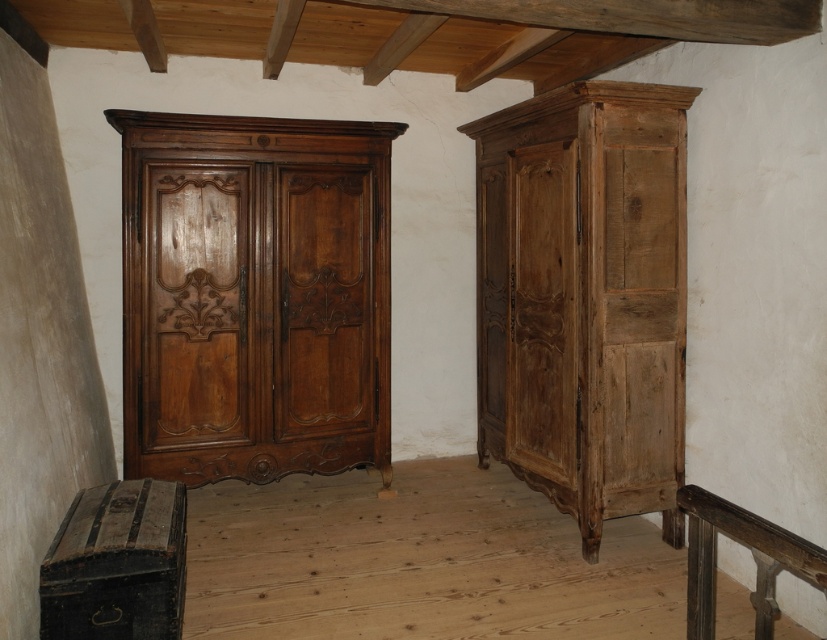
You are an interior designer planning to place a 1.2 meter wide rug in this room. The polished brown wood dresser at left and the natural wood dresser at right are both against the wall. Which dresser should the rug be placed in front of to ensure it doesn not extend beyond the dresser?

The polished brown wood dresser at left might be wider than natural wood dresser at right, so placing the rug in front of the polished brown wood dresser at left would be more likely to accommodate the rug without overhanging since it could have a larger surface area.

Consider the image. You are an interior designer planning to place a new sofa in this rustic room. The sofa is 2 meters long. You see the natural wood dresser at right and the rustic wood balustrade at lower right. Which object should you avoid placing the sofa near to ensure there is enough space?

You should avoid placing the sofa near the natural wood dresser at right because it is larger in size than the rustic wood balustrade at lower right, requiring more space.

You are standing in the room and want to place a small decorative item between the two points, point (227,358) and point (608,432). Which point is closer to you so you can start placing the item from there?

Point (227,358) is closer to you than point (608,432), so you can start placing the item from there.